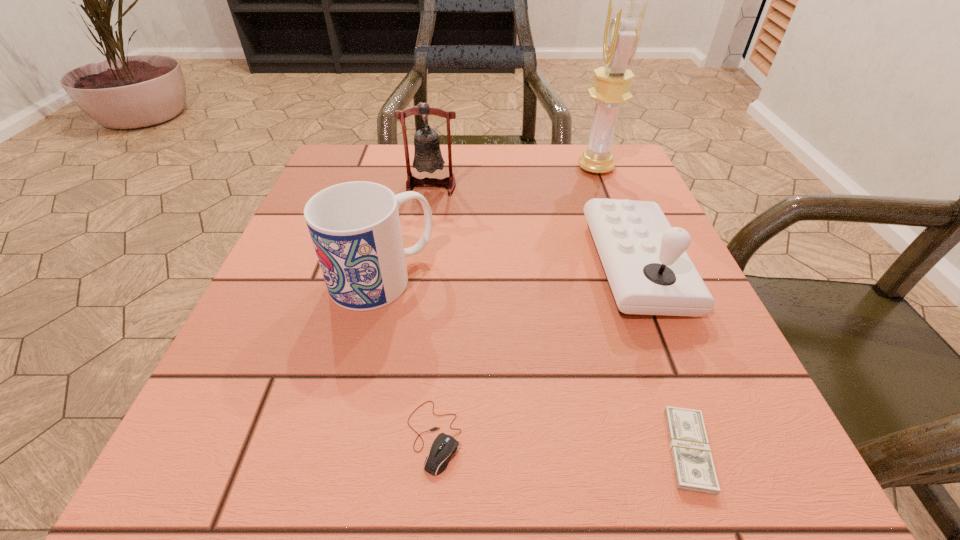
The height and width of the screenshot is (540, 960). I want to click on vacant region located 0.060m on the front of the mug, so click(367, 341).

The width and height of the screenshot is (960, 540). Find the location of `vacant space located on the left of the joystick`. vacant space located on the left of the joystick is located at coordinates (371, 266).

What are the coordinates of `vacant space situated 0.190m on the right of the computer mouse` in the screenshot? It's located at (614, 436).

The image size is (960, 540). What are the coordinates of `vacant region located on the left of the shortest object` in the screenshot? It's located at tap(589, 450).

The width and height of the screenshot is (960, 540). I want to click on award that is at the far edge, so click(x=625, y=17).

Find the location of a particular element. The image size is (960, 540). bell at the far edge is located at coordinates (427, 156).

At what (x,y) coordinates should I click in order to perform the action: click on computer mouse positioned at the near edge. Please return your answer as a coordinate pair (x, y). Looking at the image, I should click on (444, 446).

At what (x,y) coordinates should I click in order to perform the action: click on money that is at the near edge. Please return your answer as a coordinate pair (x, y). Image resolution: width=960 pixels, height=540 pixels. Looking at the image, I should click on (694, 470).

Locate an element on the screen. object at the left edge is located at coordinates (355, 228).

This screenshot has width=960, height=540. Identify the location of award that is at the right edge. (x=625, y=17).